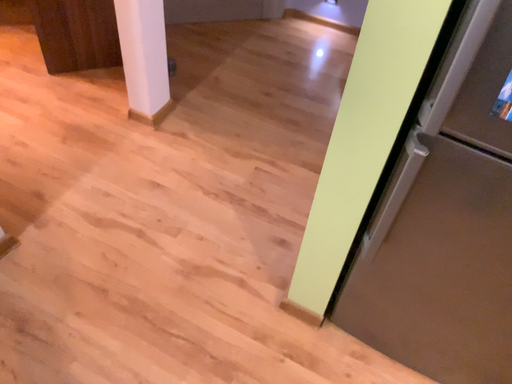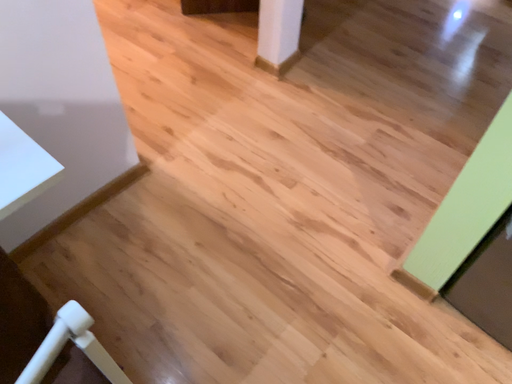
Question: How did the camera likely rotate when shooting the video?

Choices:
 (A) rotated right
 (B) rotated left

Answer: (B)